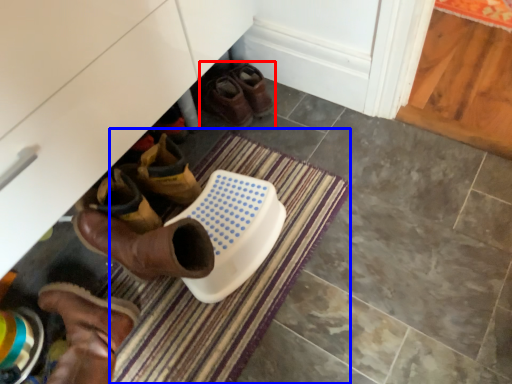
Question: Which point is further to the camera, footwear (highlighted by a red box) or bath mat (highlighted by a blue box)?

Choices:
 (A) footwear
 (B) bath mat

Answer: (A)